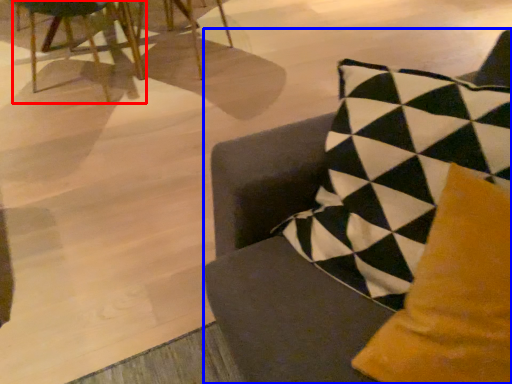
Question: Which object is closer to the camera taking this photo, chair (highlighted by a red box) or chair (highlighted by a blue box)?

Choices:
 (A) chair
 (B) chair

Answer: (B)